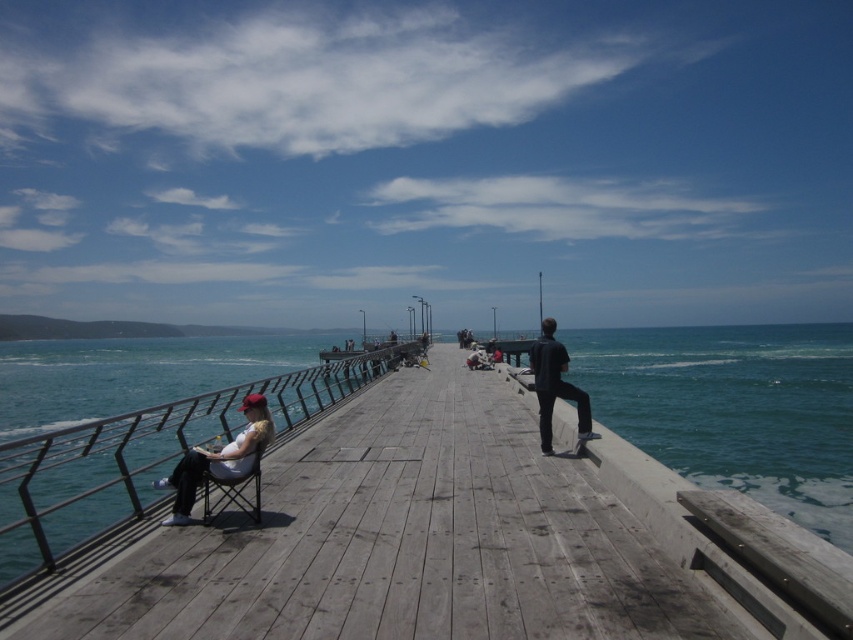
Question: Is greenish-blue water at right positioned at the back of matte white folding chair at left?

Choices:
 (A) yes
 (B) no

Answer: (A)

Question: Is weathered wood dock at center positioned at the back of matte white shirt at left?

Choices:
 (A) yes
 (B) no

Answer: (B)

Question: Which point is farther to the camera?

Choices:
 (A) (791, 392)
 (B) (546, 326)

Answer: (A)

Question: Which point is farther to the camera?

Choices:
 (A) weathered wood dock at center
 (B) greenish-blue water at right
 (C) dark blue fabric pants at center

Answer: (B)

Question: Estimate the real-world distances between objects in this image. Which object is farther from the dark blue fabric pants at center?

Choices:
 (A) matte white shirt at left
 (B) greenish-blue water at right
 (C) matte white folding chair at left
 (D) metallic silver rail at left

Answer: (B)

Question: Is metallic silver rail at left behind dark blue fabric pants at center?

Choices:
 (A) no
 (B) yes

Answer: (A)